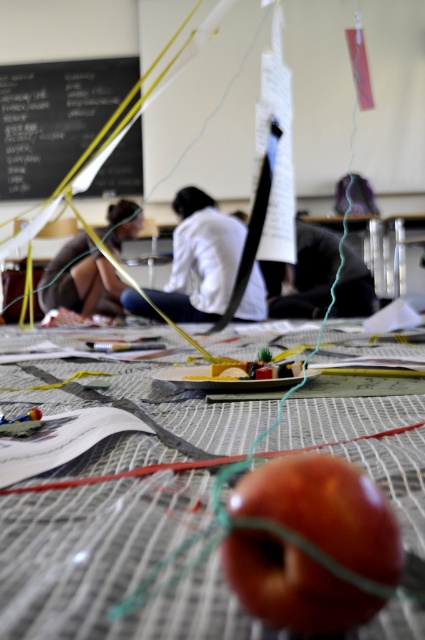
Consider the image. Who is more distant from viewer, (82, 518) or (45, 65)?

Positioned behind is point (45, 65).

Does point (124, 579) lie in front of point (76, 60)?

Yes, point (124, 579) is closer to viewer.

Find the location of a particular element. shiny metallic apple at center is located at coordinates (112, 563).

Is glossy red apple at center positioned before matte brown hair at center?

Yes, it is.

I want to click on glossy red apple at center, so click(325, 509).

Which is more to the right, shiny metallic apple at center or white matte shirt at center?

From the viewer's perspective, shiny metallic apple at center appears more on the right side.

Does point (36, 362) come closer to viewer compared to point (186, 228)?

Yes, it is.

I want to click on shiny metallic apple at center, so click(112, 563).